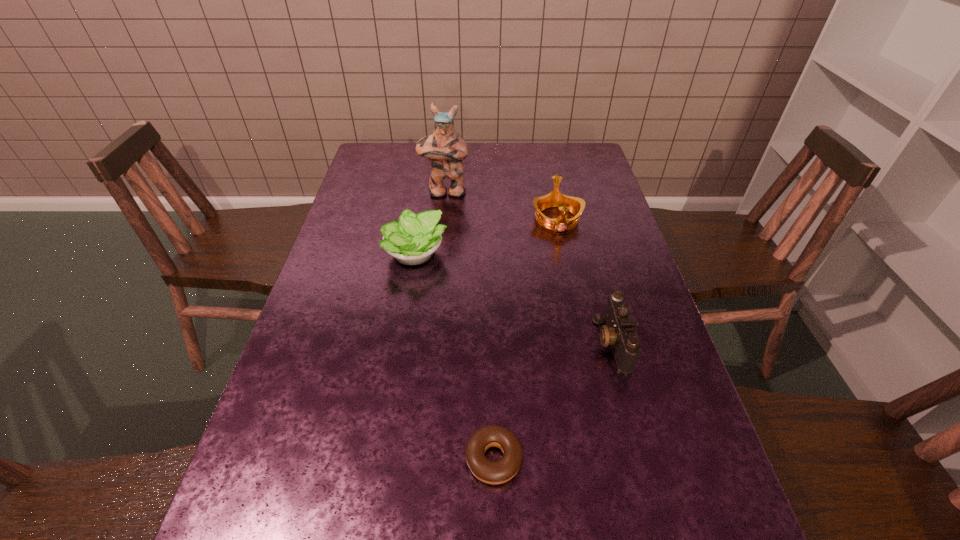
Locate an element on the screen. The image size is (960, 540). free space located on the front-facing side of the camera is located at coordinates (558, 342).

Where is `vacant space situated 0.250m on the front-facing side of the camera`? This screenshot has width=960, height=540. vacant space situated 0.250m on the front-facing side of the camera is located at coordinates (488, 342).

I want to click on vacant point located on the front-facing side of the camera, so click(562, 342).

The image size is (960, 540). What are the coordinates of `vacant space located 0.100m on the back of the shortest object` in the screenshot? It's located at (492, 387).

Find the location of a particular element. This screenshot has width=960, height=540. object that is at the left edge is located at coordinates (412, 240).

This screenshot has width=960, height=540. I want to click on tiara that is at the right edge, so click(x=555, y=198).

Find the location of a particular element. This screenshot has height=540, width=960. camera located in the right edge section of the desktop is located at coordinates (619, 332).

This screenshot has width=960, height=540. I want to click on vacant space at the left edge, so click(x=350, y=203).

In the image, there is a desktop. In order to click on vacant space at the right edge in this screenshot , I will do `click(576, 197)`.

Locate an element on the screen. The height and width of the screenshot is (540, 960). free space at the far left corner is located at coordinates (371, 161).